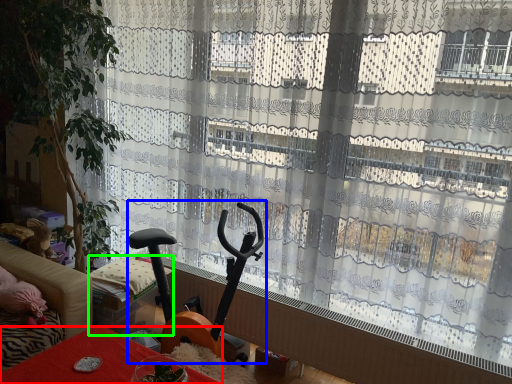
Question: Estimate the real-world distances between objects in this image. Which object is farther from furniture (highlighted by a red box), baby carriage (highlighted by a blue box) or furniture (highlighted by a green box)?

Choices:
 (A) baby carriage
 (B) furniture

Answer: (A)